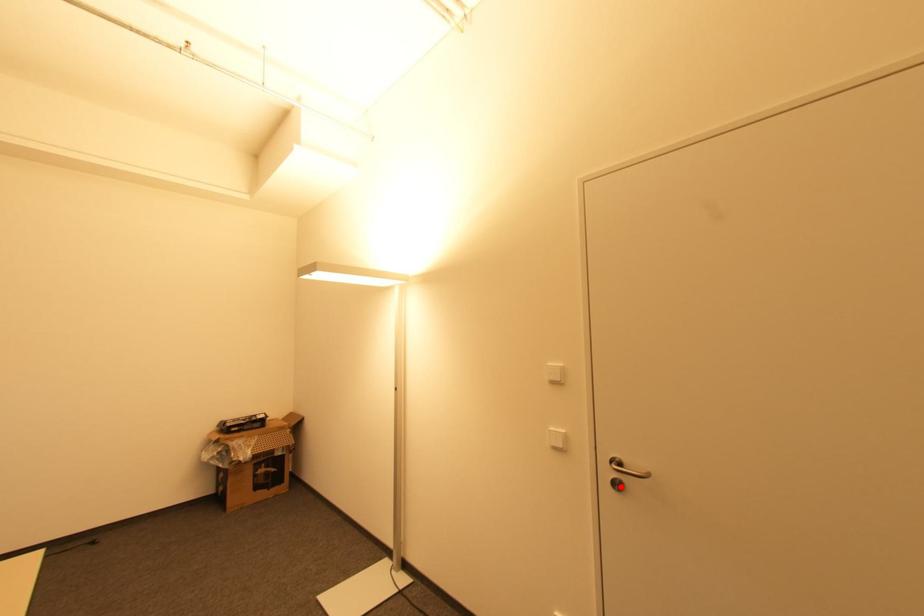
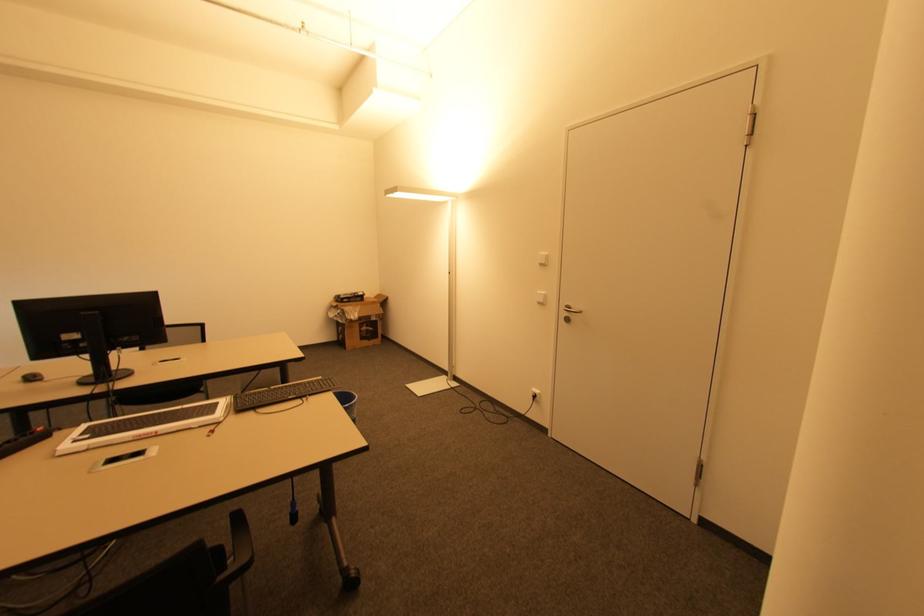
Locate, in the second image, the point that corresponds to the highlighted location in the first image.

(568, 320)